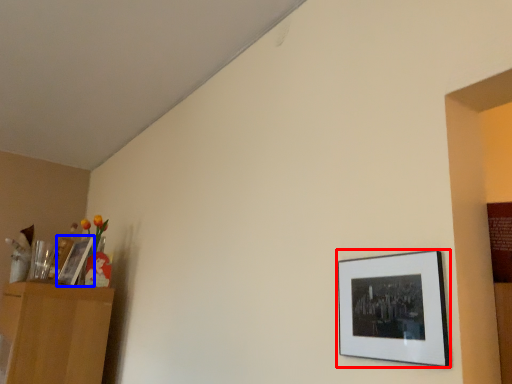
Question: Which object is closer to the camera taking this photo, picture frame (highlighted by a red box) or picture frame (highlighted by a blue box)?

Choices:
 (A) picture frame
 (B) picture frame

Answer: (A)